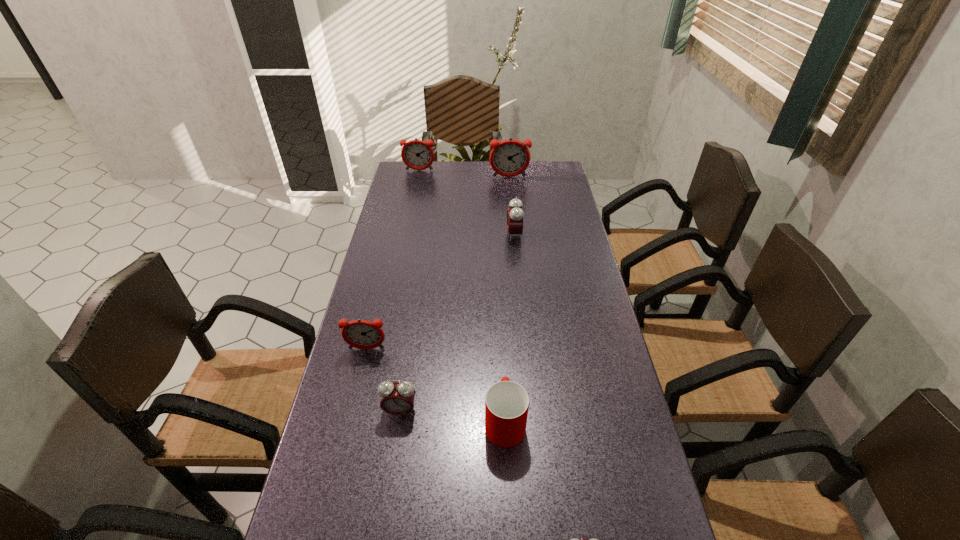
Where is `the rightmost reddish-pink alarm clock`? the rightmost reddish-pink alarm clock is located at coordinates (508, 158).

The image size is (960, 540). What are the coordinates of `the biggest reddish-pink alarm clock` in the screenshot? It's located at pyautogui.click(x=508, y=158).

At what (x,y) coordinates should I click in order to perform the action: click on the farthest object. Please return your answer as a coordinate pair (x, y). Image resolution: width=960 pixels, height=540 pixels. Looking at the image, I should click on (418, 155).

Locate an element on the screen. The image size is (960, 540). the farthest reddish-pink alarm clock is located at coordinates (418, 155).

This screenshot has width=960, height=540. What are the coordinates of `the farthest pink alarm clock` in the screenshot? It's located at (515, 215).

Identify the location of the fifth nearest object. This screenshot has width=960, height=540. (515, 215).

Where is `red cup`? The height and width of the screenshot is (540, 960). red cup is located at coordinates (506, 403).

Where is `the leftmost pink alarm clock`? the leftmost pink alarm clock is located at coordinates (397, 398).

You are a GUI agent. You are given a task and a screenshot of the screen. Output one action in this format:
    pyautogui.click(x=<x>, y=<y>)
    Task: Click on the second farthest pink alarm clock
    
    Given the screenshot: What is the action you would take?
    pyautogui.click(x=397, y=398)

Find the location of a particular element. Image resolution: width=960 pixels, height=540 pixels. the nearest reddish-pink alarm clock is located at coordinates (362, 334).